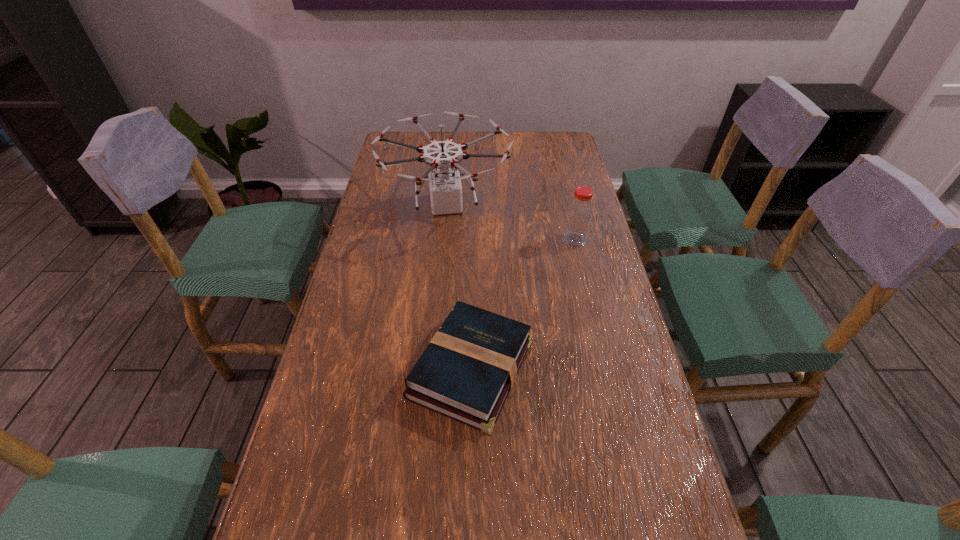
Locate an element on the screen. This screenshot has width=960, height=540. object that is the closest to the tallest object is located at coordinates (579, 215).

At what (x,y) coordinates should I click in order to perform the action: click on free location that satisfies the following two spatial constraints: 1. on the front side of the tallest object; 2. on the left side of the nearest object. Please return your answer as a coordinate pair (x, y). The image size is (960, 540). Looking at the image, I should click on (431, 369).

Where is `vacant region that satisfies the following two spatial constraints: 1. on the back side of the hardback book; 2. on the left side of the second tallest object`? The image size is (960, 540). vacant region that satisfies the following two spatial constraints: 1. on the back side of the hardback book; 2. on the left side of the second tallest object is located at coordinates (473, 240).